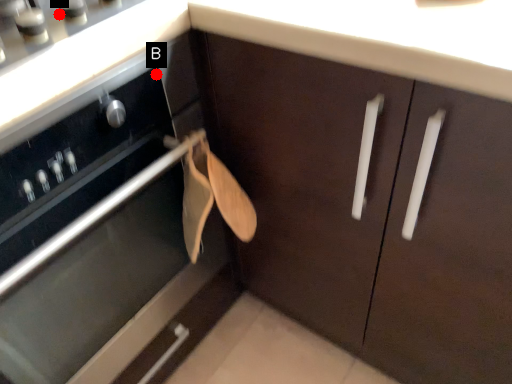
Question: Two points are circled on the image, labeled by A and B beside each circle. Which point is closer to the camera?

Choices:
 (A) A is closer
 (B) B is closer

Answer: (A)